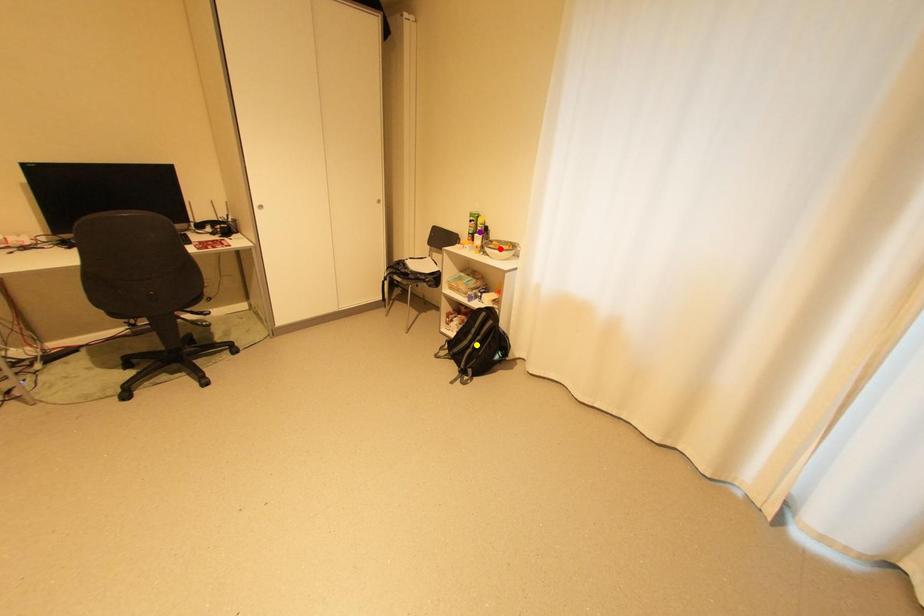
Order these from nearest to farthest:
red point | purple point | yellow point

yellow point
red point
purple point